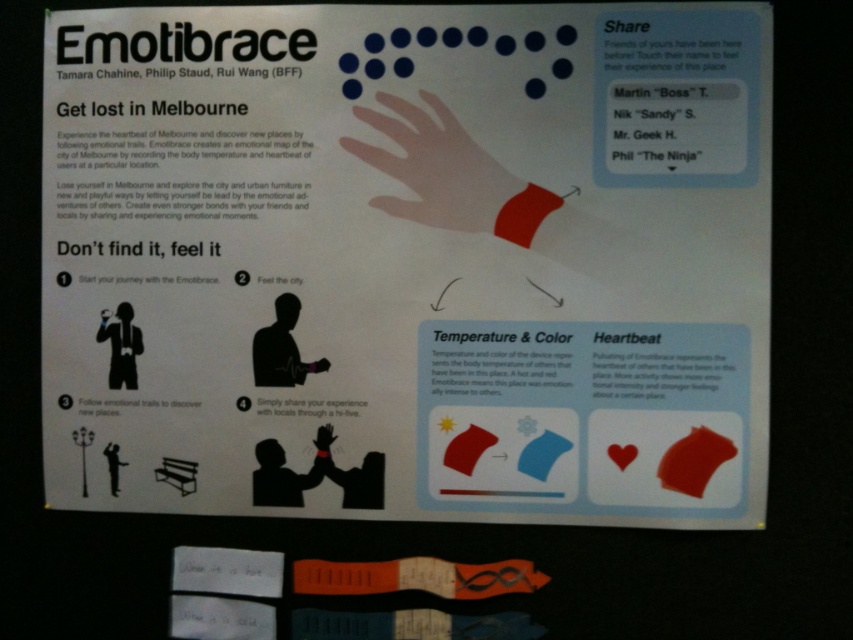
Question: Among these points, which one is farthest from the camera?

Choices:
 (A) (131, 144)
 (B) (503, 189)

Answer: (A)

Question: Is white paper poster at upper center positioned behind white matte hand at center?

Choices:
 (A) yes
 (B) no

Answer: (B)

Question: Which point is farther from the camera taking this photo?

Choices:
 (A) (438, 145)
 (B) (752, 12)

Answer: (A)

Question: Can you confirm if white paper poster at upper center is positioned to the right of white matte hand at center?

Choices:
 (A) no
 (B) yes

Answer: (A)

Question: Is white paper poster at upper center smaller than white matte hand at center?

Choices:
 (A) no
 (B) yes

Answer: (A)